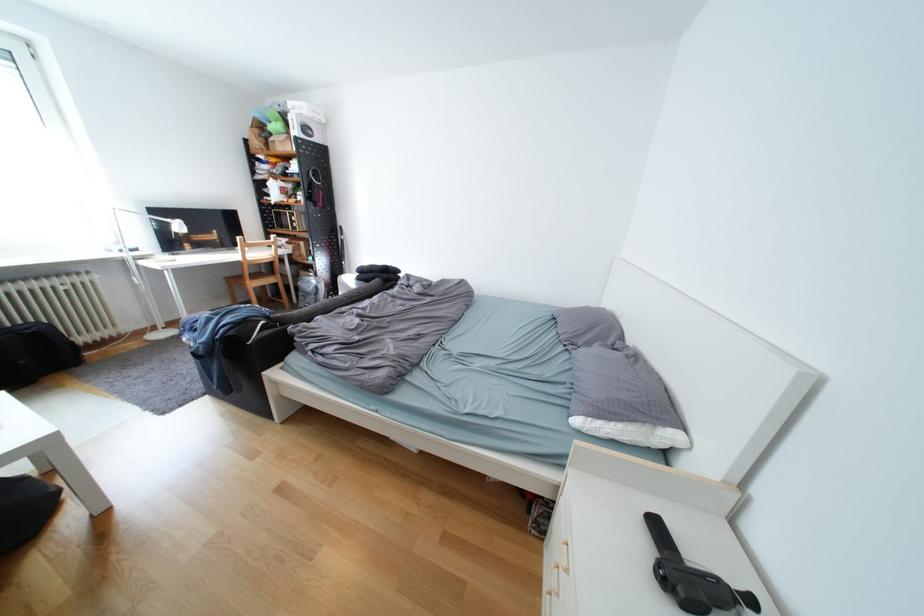
Where would you sit the chair sitting surface? Please return your answer as a coordinate pair (x, y).

(261, 272)